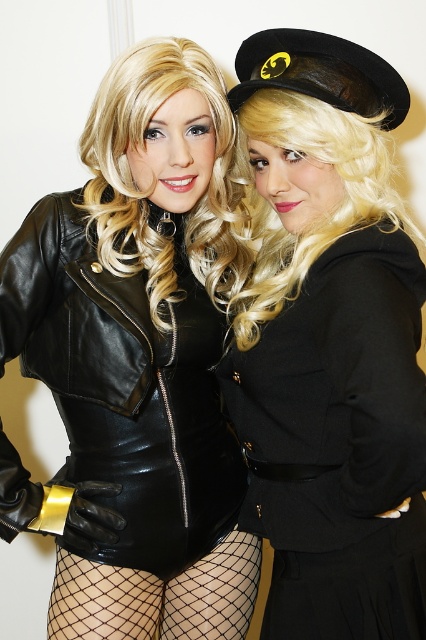
You are a photographer setting up a camera at position point 0.5, 0.5. You need to capture a closeup shot of the matte black bodysuit at center. Based on the coordinates provided, will the bodysuit be in the center of your frame?

The matte black bodysuit at center is located at coordinates point (x=137, y=362), which is slightly to the right and below the camera position at point (x=213, y=320). Therefore, it will not be perfectly centered in the frame.

You are a photographer setting up for a photoshoot. You need to ensure that both the matte black bodysuit at center and the black woolen dress at center are visible in the frame. Based on their positions, which one is closer to the camera?

The matte black bodysuit at center is closer to the camera because the black woolen dress at center is positioned behind it.

You are a photographer at a costume event and need to capture both the matte black bodysuit at center and the black woolen dress at center clearly in your photo. Which one is covering the other in the image?

The matte black bodysuit at center is positioned over the black woolen dress at center, so it is covering the other.